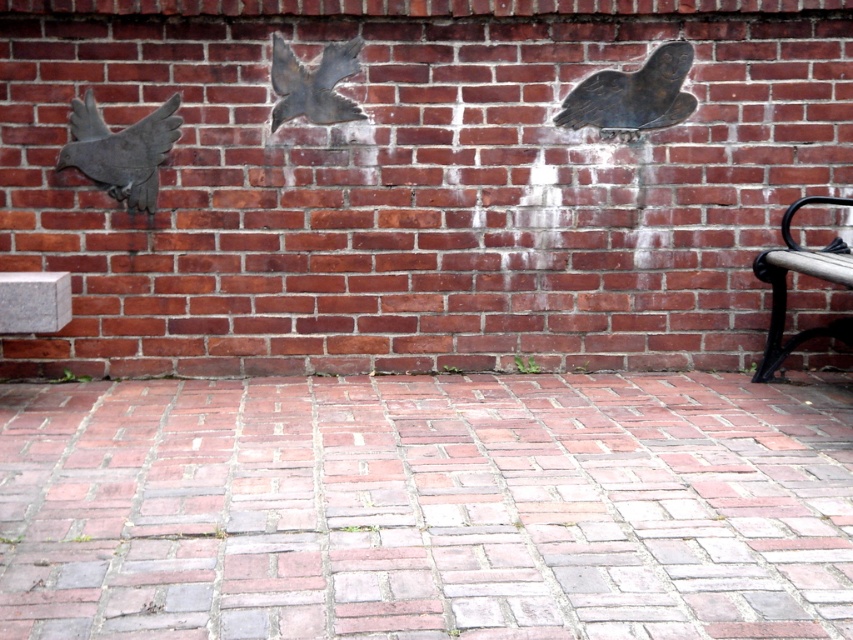
You are a painter standing in front of the brick wall. You need to paint the area above the brushed metal pigeon at upper right and the area above the brushed metal pigeon at left. Which area will require more paint?

The area above the brushed metal pigeon at left will require more paint because the brushed metal pigeon at upper right has a lesser height compared to the brushed metal pigeon at left, meaning the left pigeon is taller and thus its shadow or space above it is larger.

You are standing in front of the brick wall with three metal bird sculptures. You notice a point at coordinates point (643, 124). If you want to touch this point with a 3.5 meter long pole, will the pole be long enough?

The distance of point (643, 124) from the camera is 4.03 meters. Since the pole is only 3.5 meters long, it will not reach the point.